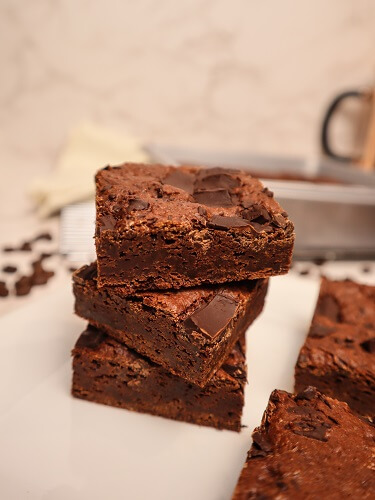
In order to click on napkin in this screenshot , I will do `click(77, 161)`.